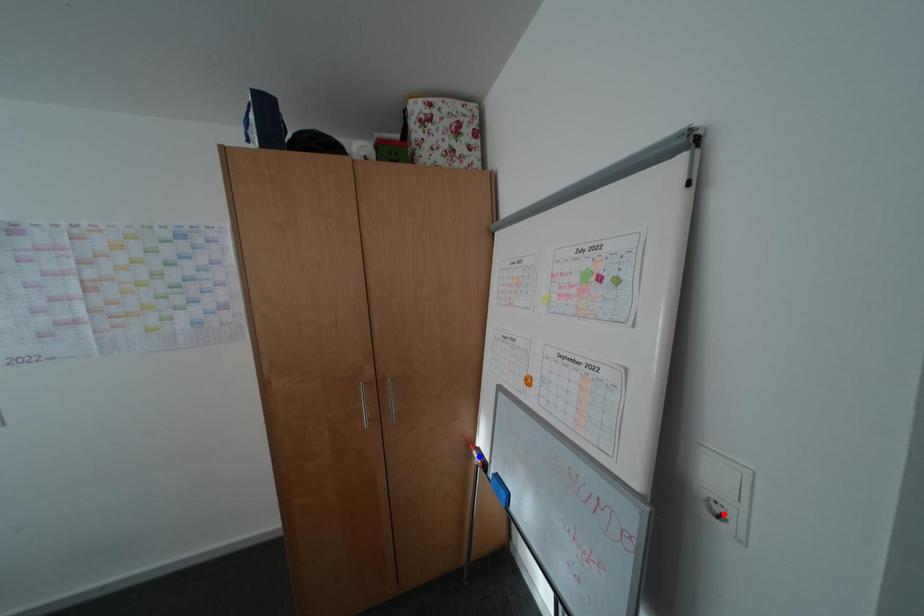
Question: Which of the two points in the image is closer to the camera?

Choices:
 (A) Blue point is closer.
 (B) Red point is closer.

Answer: (B)